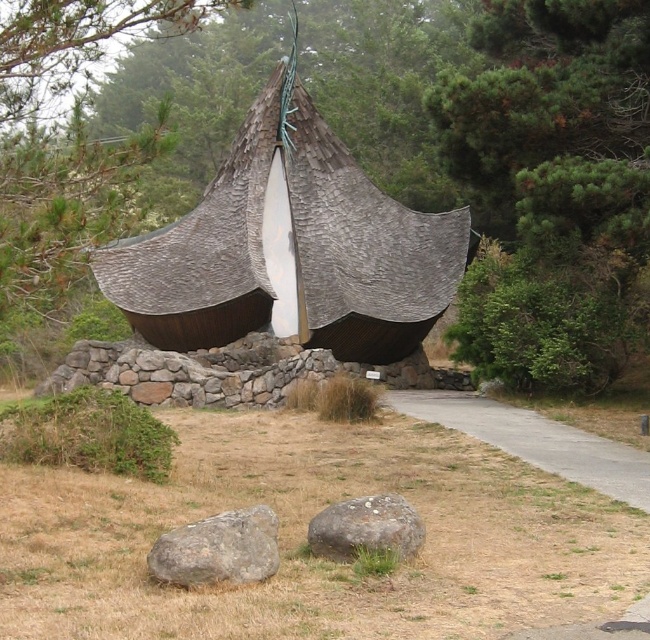
You are standing at the base of the structure and want to walk towards the point labeled as point [237,534]. As you move forward, will the point labeled point [313,285] come into your line of sight?

Since point [313,285] is behind point [237,534], it will not come into your line of sight as you move towards point [237,534].